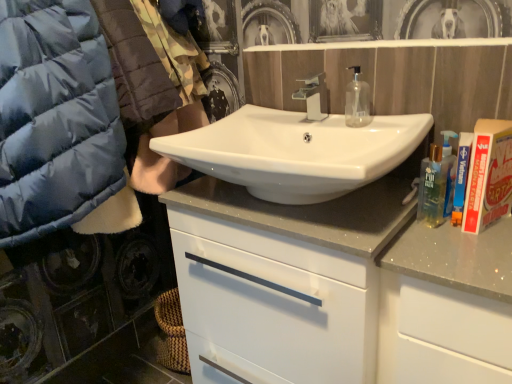
Identify the location of vacant space behind silver metallic faucet at center. The image size is (512, 384). 285,112.